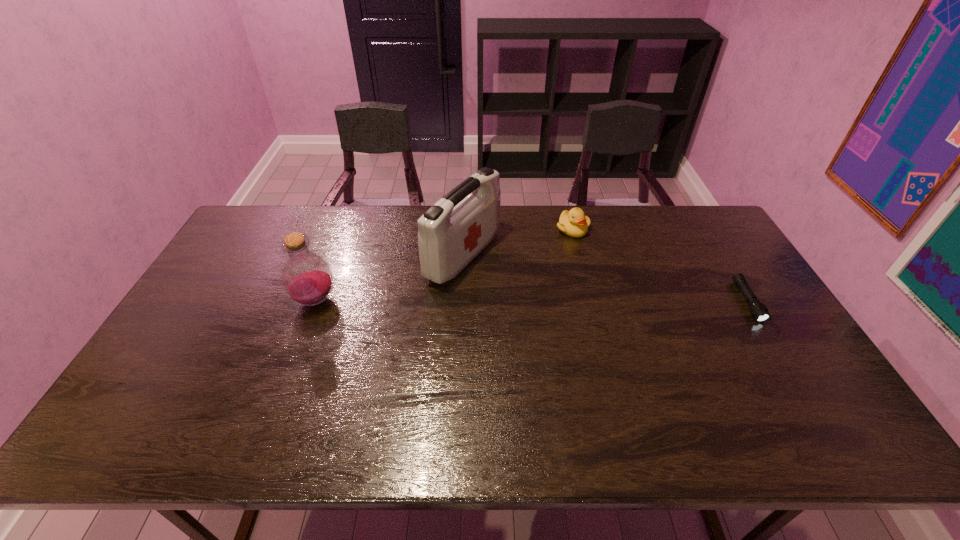
Identify the location of the leftmost object. (x=307, y=278).

Identify the location of flashlight. Image resolution: width=960 pixels, height=540 pixels. (759, 311).

Find the location of a particular element. The image size is (960, 540). the rightmost object is located at coordinates (759, 311).

The width and height of the screenshot is (960, 540). I want to click on the third object from right to left, so click(x=451, y=233).

Where is `duckling`? duckling is located at coordinates (573, 223).

Find the location of `the second object from right to left`. the second object from right to left is located at coordinates (573, 223).

Find the location of a particular element. This screenshot has width=960, height=540. vacant space located on the left of the leftmost object is located at coordinates (273, 300).

Locate an element on the screen. The width and height of the screenshot is (960, 540). vacant space situated at the lens end of the flashlight is located at coordinates (794, 378).

At what (x,y) coordinates should I click in order to perform the action: click on free space located 0.150m on the front side of the first-aid kit. Please return your answer as a coordinate pair (x, y). The height and width of the screenshot is (540, 960). Looking at the image, I should click on (538, 293).

I want to click on free spot located on the front side of the first-aid kit, so click(x=520, y=285).